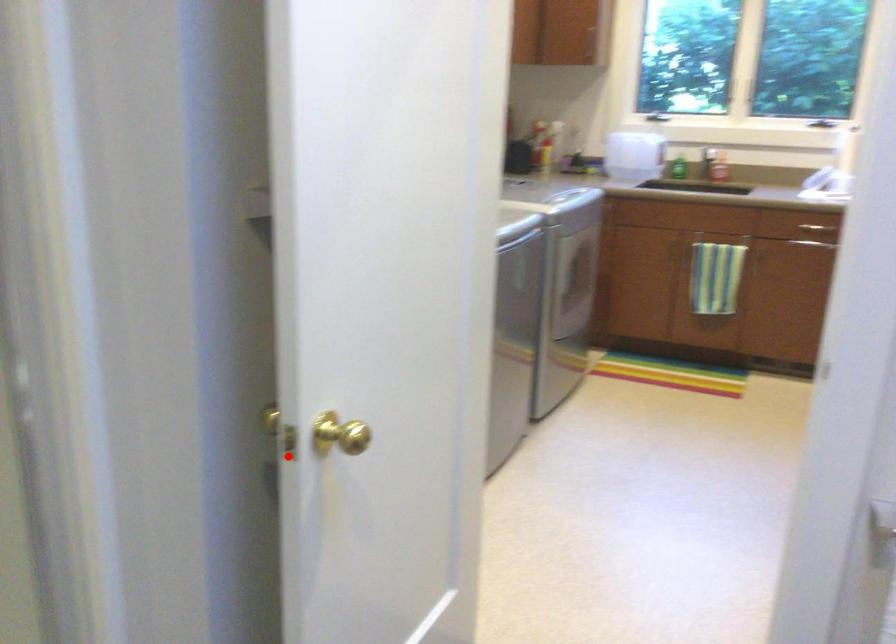
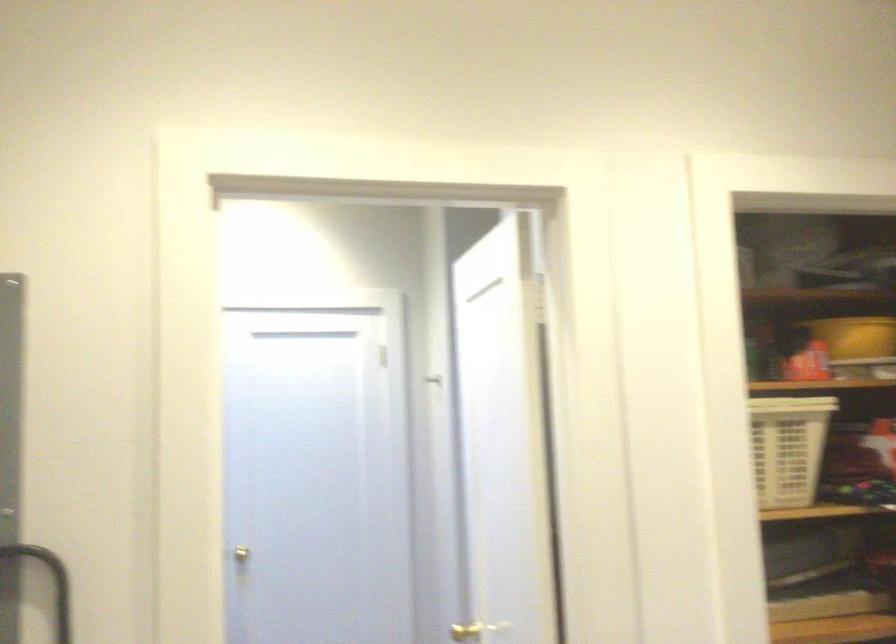
Question: I am providing you with two images of the same scene from different viewpoints. Image1 has a red point marked. In image2, the corresponding 3D location appears at what relative position? Reply with the corresponding letter.

Choices:
 (A) Closer
 (B) Farther

Answer: (B)